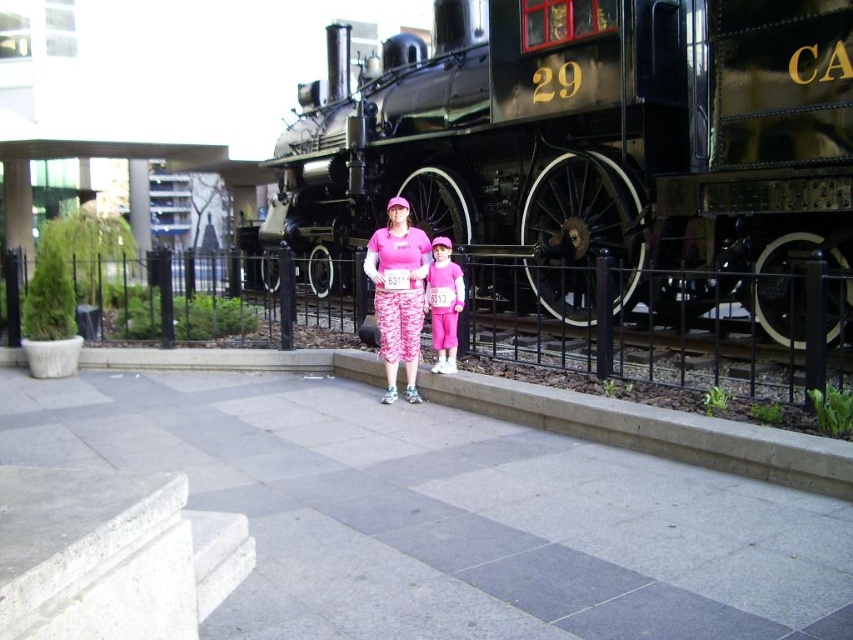
Question: Which object is positioned farthest from the shiny black locomotive at center?

Choices:
 (A) pink matte/cotton t-shirt at center
 (B) matte pink leggings at center

Answer: (A)

Question: Which point is closer to the camera?

Choices:
 (A) (378, 228)
 (B) (529, 99)
 (C) (438, 342)
 (D) (842, 365)

Answer: (D)

Question: Is shiny black locomotive at center to the left of matte pink leggings at center from the viewer's perspective?

Choices:
 (A) no
 (B) yes

Answer: (B)

Question: Which of the following is the farthest from the observer?

Choices:
 (A) black metal train track at center
 (B) shiny black locomotive at center

Answer: (A)

Question: Is shiny black locomotive at center thinner than black metal train track at center?

Choices:
 (A) no
 (B) yes

Answer: (A)

Question: Considering the relative positions of black metal train track at center and pink matte/cotton t-shirt at center in the image provided, where is black metal train track at center located with respect to pink matte/cotton t-shirt at center?

Choices:
 (A) above
 (B) below

Answer: (B)